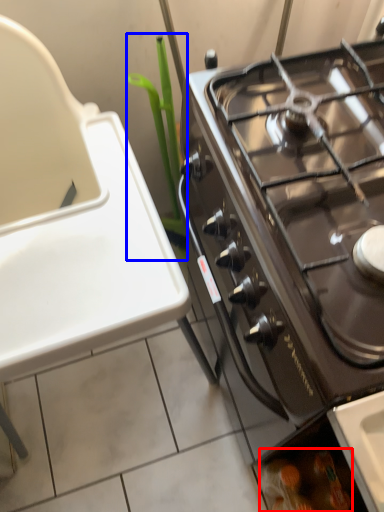
Question: Which point is closer to the camera, food (highlighted by a red box) or plant (highlighted by a blue box)?

Choices:
 (A) food
 (B) plant

Answer: (B)